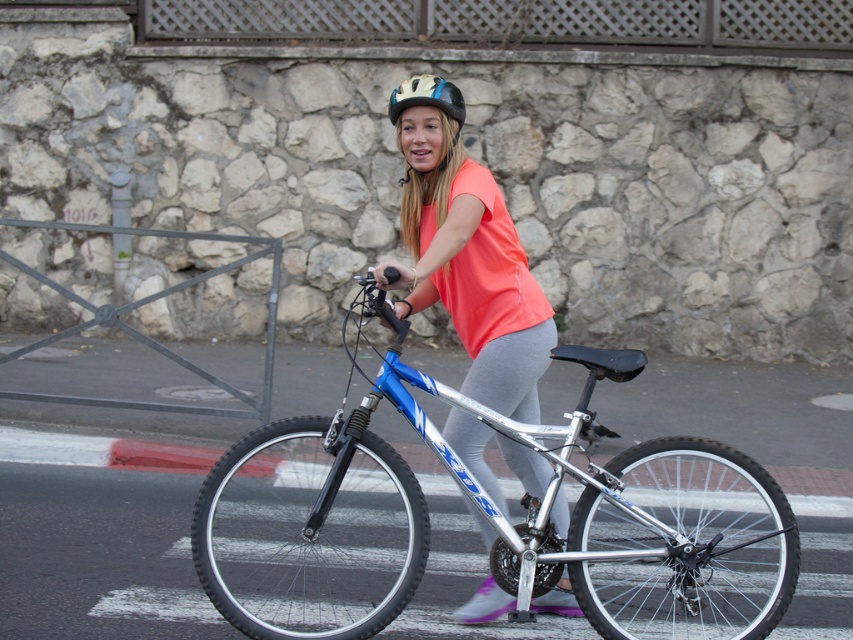
Where is the matte orange shirt at center located in the image?

The matte orange shirt at center is located at point coordinates of 0.395 on the x axis and 0.547 on the y axis.

You are a pedestrian standing at the pedestrian crossing and see a cyclist wearing the matte orange shirt at center and the matte yellow helmet at center. Which clothing item is positioned higher on the cyclist?

The matte yellow helmet at center is positioned higher than the matte orange shirt at center because the matte orange shirt at center is located below it.

You are a pedestrian standing on the sidewalk observing the silver metallic bicycle at center and the matte yellow helmet at center. Which object is positioned more to the right?

The silver metallic bicycle at center is positioned more to the right than the matte yellow helmet at center.